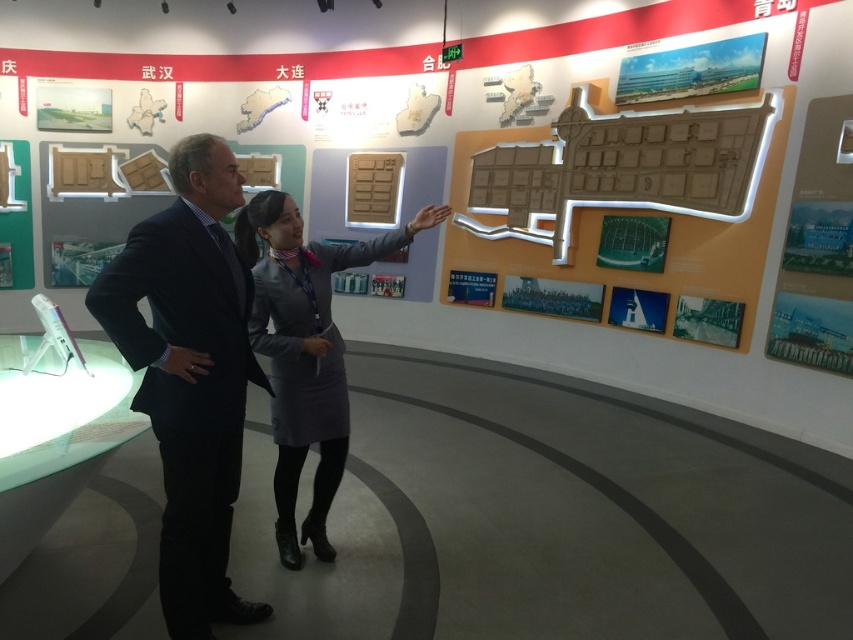
Who is positioned more to the right, dark blue suit at center or gray fabric dress at center?

From the viewer's perspective, gray fabric dress at center appears more on the right side.

Identify the location of dark blue suit at center. The width and height of the screenshot is (853, 640). (190, 374).

The height and width of the screenshot is (640, 853). I want to click on dark blue suit at center, so click(190, 374).